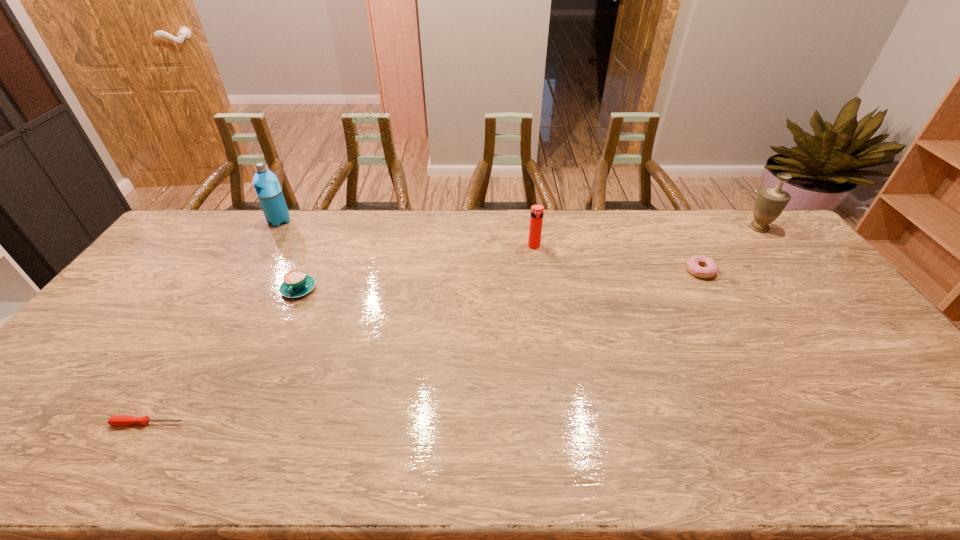
The width and height of the screenshot is (960, 540). Find the location of `empty location between the screwdriver and the doughnut`. empty location between the screwdriver and the doughnut is located at coordinates (424, 347).

The image size is (960, 540). I want to click on free space between the rightmost object and the taller thermos bottle, so click(519, 224).

Where is `empty location between the fifth tallest object and the taller thermos bottle`? empty location between the fifth tallest object and the taller thermos bottle is located at coordinates (490, 246).

At what (x,y) coordinates should I click in order to perform the action: click on vacant space that is in between the taller thermos bottle and the shortest object. Please return your answer as a coordinate pair (x, y). The width and height of the screenshot is (960, 540). Looking at the image, I should click on (214, 322).

Select which object appears as the closest to the rightmost object. Please provide its 2D coordinates. Your answer should be formatted as a tuple, i.e. [(x, y)], where the tuple contains the x and y coordinates of a point satisfying the conditions above.

[(694, 263)]

Identify which object is the second closest to the second shortest object. Please provide its 2D coordinates. Your answer should be formatted as a tuple, i.e. [(x, y)], where the tuple contains the x and y coordinates of a point satisfying the conditions above.

[(536, 219)]

Identify the location of vacant region that satisfies the following two spatial constraints: 1. with the handle on the right side of the third object from left to right; 2. at the tip of the nearest object. (239, 423).

You are a GUI agent. You are given a task and a screenshot of the screen. Output one action in this format:
    pyautogui.click(x=<x>, y=<y>)
    Task: Click on the free space that satisfies the following two spatial constraints: 1. on the front side of the third farthest object; 2. on the right side of the taller thermos bottle
    The height and width of the screenshot is (540, 960).
    Given the screenshot: What is the action you would take?
    pyautogui.click(x=265, y=246)